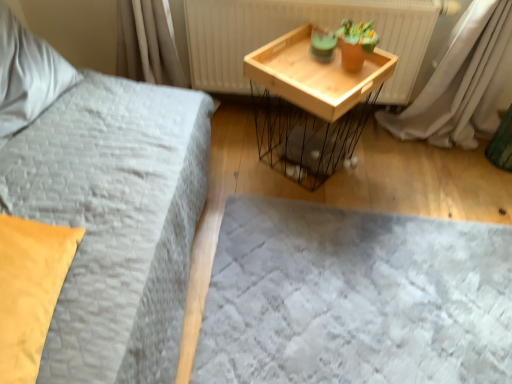
Locate an element on the screen. free space below soft gray fabric bed frame at lower center (from a real-world perspective) is located at coordinates (373, 301).